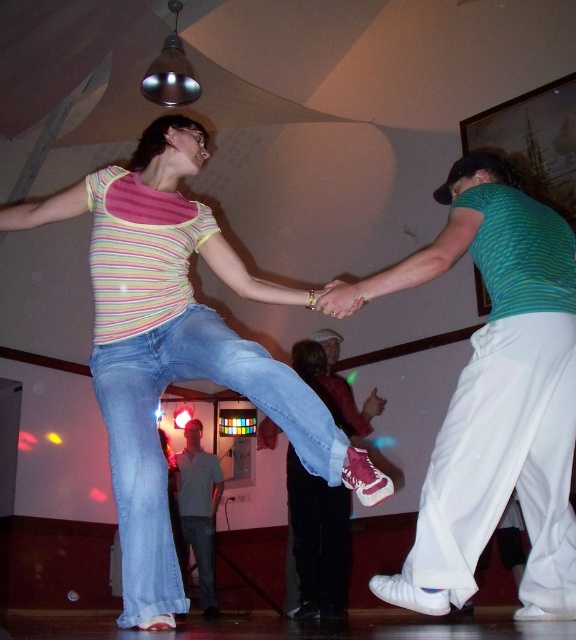
Question: From the image, what is the correct spatial relationship of blue denim jeans at center in relation to light blue jeans at lower center?

Choices:
 (A) right
 (B) left

Answer: (A)

Question: Can you confirm if striped cotton shirt at center is positioned to the right of blue denim jeans at center?

Choices:
 (A) no
 (B) yes

Answer: (A)

Question: Observing the image, what is the correct spatial positioning of striped cotton shirt at center in reference to matte green shirt at right?

Choices:
 (A) below
 (B) above

Answer: (B)

Question: Based on their relative distances, which object is nearer to the striped cotton shirt at center?

Choices:
 (A) white cotton pants at lower right
 (B) blue denim jeans at center

Answer: (B)

Question: Among these points, which one is nearest to the camera?

Choices:
 (A) (187, 476)
 (B) (164, 186)
 (C) (452, 520)

Answer: (C)

Question: Which of the following is the farthest from the observer?

Choices:
 (A) striped cotton shirt at center
 (B) white cotton pants at lower right
 (C) matte green shirt at right

Answer: (B)